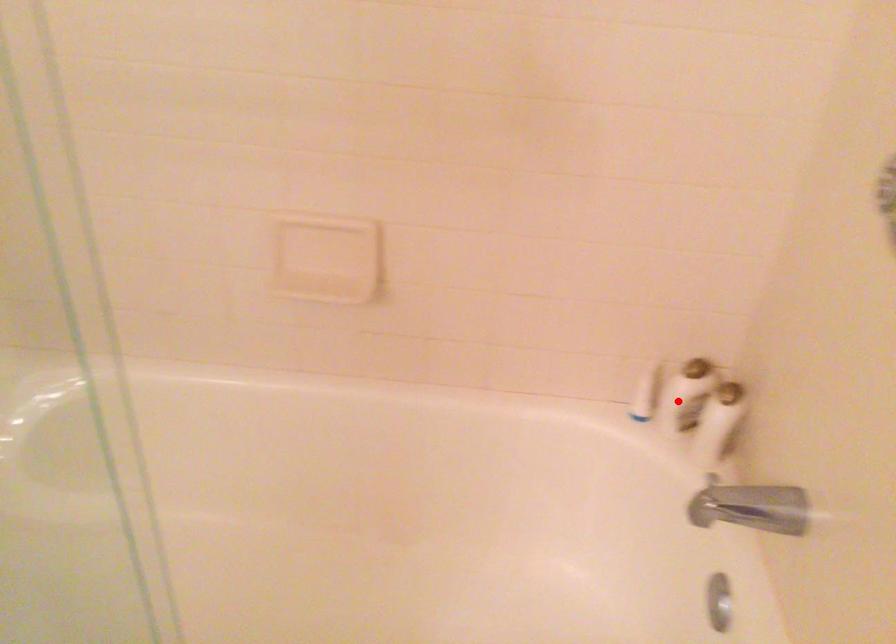
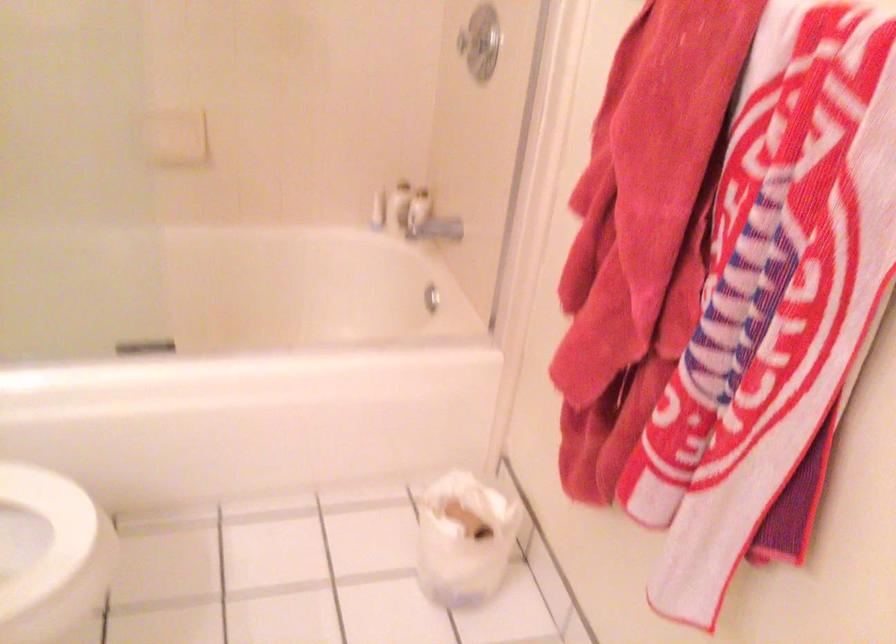
Question: I am providing you with two images of the same scene from different viewpoints. Given a red point in image1, look at the same physical point in image2. Is it:

Choices:
 (A) Closer to the viewpoint
 (B) Farther from the viewpoint

Answer: (B)